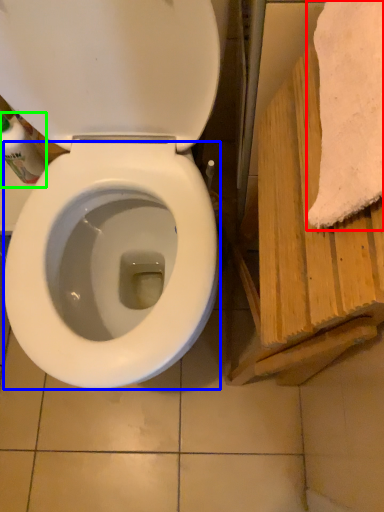
Question: Which is farther away from bath towel (highlighted by a red box)? bidet (highlighted by a blue box) or cleaning product (highlighted by a green box)?

Choices:
 (A) bidet
 (B) cleaning product

Answer: (B)